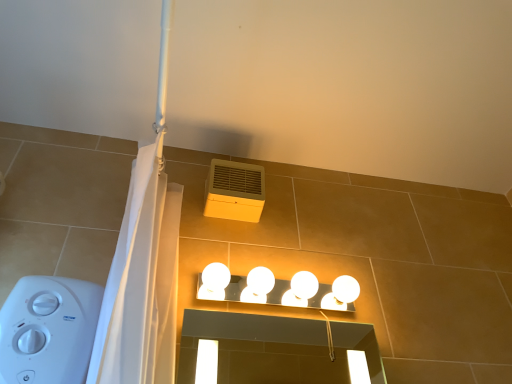
Question: Is yellow matte air conditioning at upper center in front of or behind white glossy light fixture at upper center in the image?

Choices:
 (A) behind
 (B) front

Answer: (A)

Question: Visually, is yellow matte air conditioning at upper center positioned to the left or to the right of white glossy light fixture at upper center?

Choices:
 (A) left
 (B) right

Answer: (A)

Question: Is yellow matte air conditioning at upper center wider or thinner than white glossy light fixture at upper center?

Choices:
 (A) wide
 (B) thin

Answer: (B)

Question: Is white glossy light fixture at upper center wider or thinner than yellow matte air conditioning at upper center?

Choices:
 (A) wide
 (B) thin

Answer: (A)

Question: Is white glossy light fixture at upper center taller or shorter than yellow matte air conditioning at upper center?

Choices:
 (A) short
 (B) tall

Answer: (A)

Question: From a real-world perspective, is white glossy light fixture at upper center physically located above or below yellow matte air conditioning at upper center?

Choices:
 (A) below
 (B) above

Answer: (A)

Question: Does point (353, 297) appear closer or farther from the camera than point (254, 168)?

Choices:
 (A) closer
 (B) farther

Answer: (A)